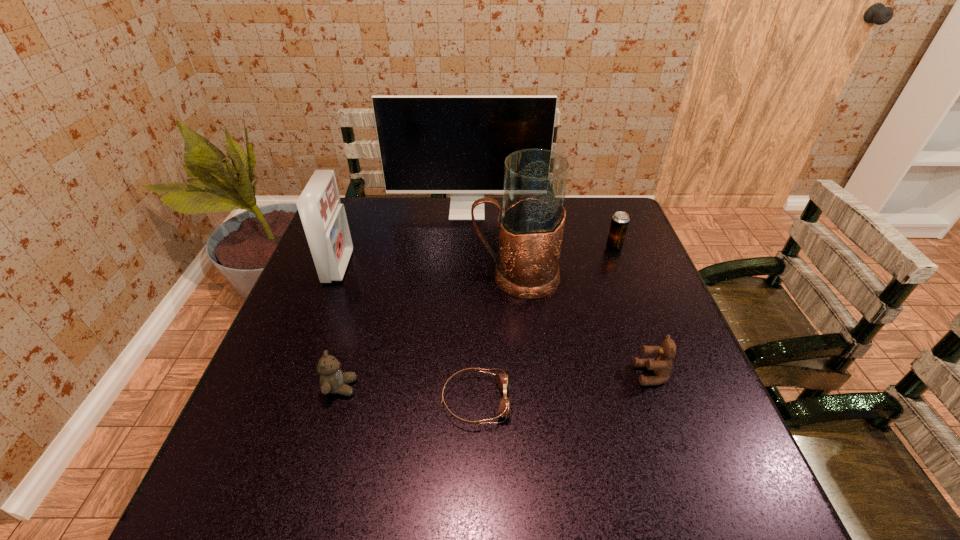
Locate an element on the screen. The width and height of the screenshot is (960, 540). free region at the far right corner of the desktop is located at coordinates (616, 207).

Identify the location of free space between the left teddy bear and the shortest object. (408, 394).

The height and width of the screenshot is (540, 960). I want to click on vacant area between the goggles and the monitor, so click(471, 306).

Locate an element on the screen. blank region between the third tallest object and the goggles is located at coordinates (407, 334).

Where is `free space between the third tallest object and the goggles`? This screenshot has height=540, width=960. free space between the third tallest object and the goggles is located at coordinates (407, 334).

Identify the location of blank region between the left teddy bear and the beer can. This screenshot has width=960, height=540. (477, 318).

Image resolution: width=960 pixels, height=540 pixels. What are the coordinates of `unoccupied position between the goggles and the beer can` in the screenshot? It's located at (544, 325).

Locate an element on the screen. free space between the farthest object and the goggles is located at coordinates (471, 306).

This screenshot has height=540, width=960. In order to click on free space between the left teddy bear and the first-aid kit in this screenshot , I will do `click(340, 327)`.

You are a GUI agent. You are given a task and a screenshot of the screen. Output one action in this format:
    pyautogui.click(x=<x>, y=<y>)
    Task: Click on the free space between the beer can and the shortest object
    The height and width of the screenshot is (540, 960).
    Given the screenshot: What is the action you would take?
    pyautogui.click(x=544, y=325)